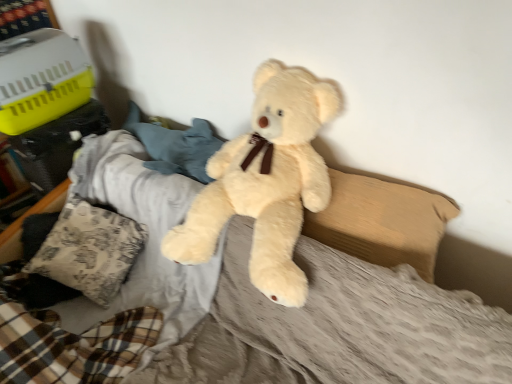
Question: From the image's perspective, is beige fabric pillow at center, which is the 1th pillow from right to left, on top of patterned fabric pillow at lower left, which is the second pillow from right to left?

Choices:
 (A) yes
 (B) no

Answer: (A)

Question: Considering the relative sizes of beige fabric pillow at center, placed as the 2th pillow when sorted from left to right, and patterned fabric pillow at lower left, which is the second pillow from right to left, in the image provided, is beige fabric pillow at center, placed as the 2th pillow when sorted from left to right, wider than patterned fabric pillow at lower left, which is the second pillow from right to left,?

Choices:
 (A) no
 (B) yes

Answer: (A)

Question: Is beige fabric pillow at center, placed as the 2th pillow when sorted from left to right, positioned in front of patterned fabric pillow at lower left, which is the second pillow from right to left?

Choices:
 (A) yes
 (B) no

Answer: (A)

Question: Is beige fabric pillow at center, placed as the 2th pillow when sorted from left to right, not within patterned fabric pillow at lower left, which is the second pillow from right to left?

Choices:
 (A) no
 (B) yes

Answer: (B)

Question: Are beige fabric pillow at center, which is the 1th pillow from right to left, and patterned fabric pillow at lower left, marked as the 1th pillow in a left-to-right arrangement, located far from each other?

Choices:
 (A) no
 (B) yes

Answer: (A)

Question: Is beige fabric pillow at center, placed as the 2th pillow when sorted from left to right, bigger than patterned fabric pillow at lower left, marked as the 1th pillow in a left-to-right arrangement?

Choices:
 (A) yes
 (B) no

Answer: (B)

Question: Is patterned fabric pillow at lower left, which is the second pillow from right to left, next to fluffy beige teddy bear at center and touching it?

Choices:
 (A) no
 (B) yes

Answer: (A)

Question: Does patterned fabric pillow at lower left, which is the second pillow from right to left, turn towards fluffy beige teddy bear at center?

Choices:
 (A) yes
 (B) no

Answer: (B)

Question: From the image's perspective, does patterned fabric pillow at lower left, which is the second pillow from right to left, appear lower than fluffy beige teddy bear at center?

Choices:
 (A) yes
 (B) no

Answer: (A)

Question: Can you confirm if patterned fabric pillow at lower left, which is the second pillow from right to left, is wider than fluffy beige teddy bear at center?

Choices:
 (A) no
 (B) yes

Answer: (A)

Question: Would you consider patterned fabric pillow at lower left, marked as the 1th pillow in a left-to-right arrangement, to be distant from fluffy beige teddy bear at center?

Choices:
 (A) no
 (B) yes

Answer: (A)

Question: Considering the relative sizes of patterned fabric pillow at lower left, marked as the 1th pillow in a left-to-right arrangement, and fluffy beige teddy bear at center in the image provided, is patterned fabric pillow at lower left, marked as the 1th pillow in a left-to-right arrangement, shorter than fluffy beige teddy bear at center?

Choices:
 (A) yes
 (B) no

Answer: (A)

Question: Does fluffy beige teddy bear at center have a lesser width compared to patterned fabric pillow at lower left, which is the second pillow from right to left?

Choices:
 (A) no
 (B) yes

Answer: (A)